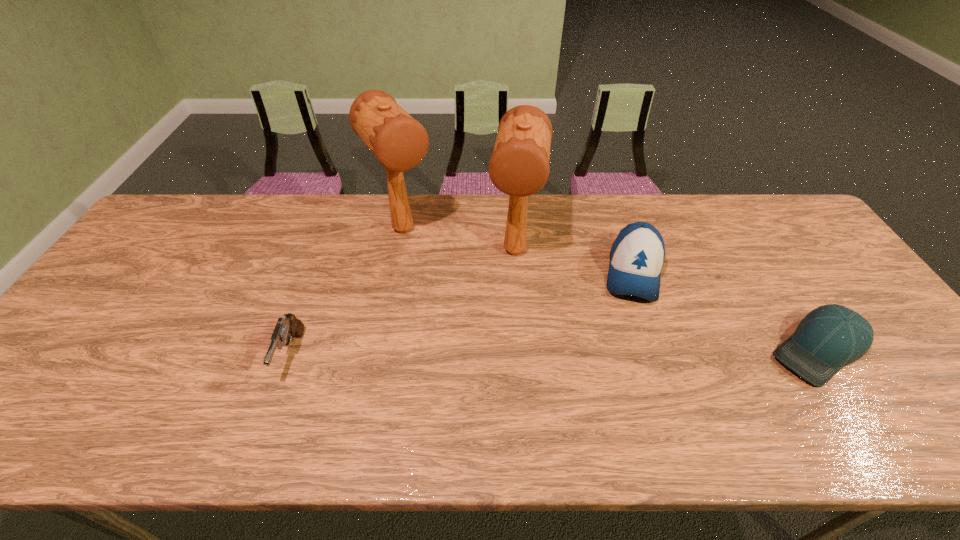
I want to click on free area in between the left baseball cap and the nearer baseball cap, so click(725, 312).

The height and width of the screenshot is (540, 960). Find the location of `vacant area that lies between the third object from left to right and the taller baseball cap`. vacant area that lies between the third object from left to right and the taller baseball cap is located at coordinates (574, 262).

Identify the location of empty space that is in between the third object from right to left and the fourth object from right to left. (459, 240).

I want to click on free space that is in between the second object from left to right and the pistol, so click(x=348, y=292).

I want to click on unoccupied position between the leftmost object and the third object from left to right, so [403, 303].

I want to click on vacant space that is in between the fourth tallest object and the third object from right to left, so click(x=403, y=303).

Find the location of `vacant space in between the fourth object from right to left and the right mallet`. vacant space in between the fourth object from right to left and the right mallet is located at coordinates (459, 240).

Where is `object that is the closest to the third object from left to right`? Image resolution: width=960 pixels, height=540 pixels. object that is the closest to the third object from left to right is located at coordinates (399, 142).

The width and height of the screenshot is (960, 540). Identify the location of the second closest object to the taller baseball cap. (828, 338).

Where is `vacant position in the image that satisfies the following two spatial constraints: 1. on the front side of the right mallet; 2. on the left side of the taller baseball cap`? vacant position in the image that satisfies the following two spatial constraints: 1. on the front side of the right mallet; 2. on the left side of the taller baseball cap is located at coordinates (516, 273).